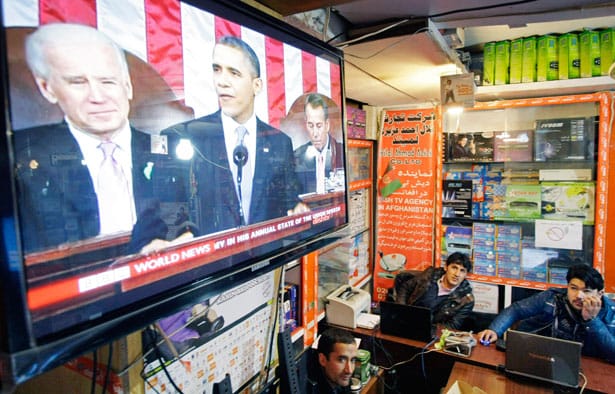
Where is `printer`? Image resolution: width=615 pixels, height=394 pixels. printer is located at coordinates (334, 293).